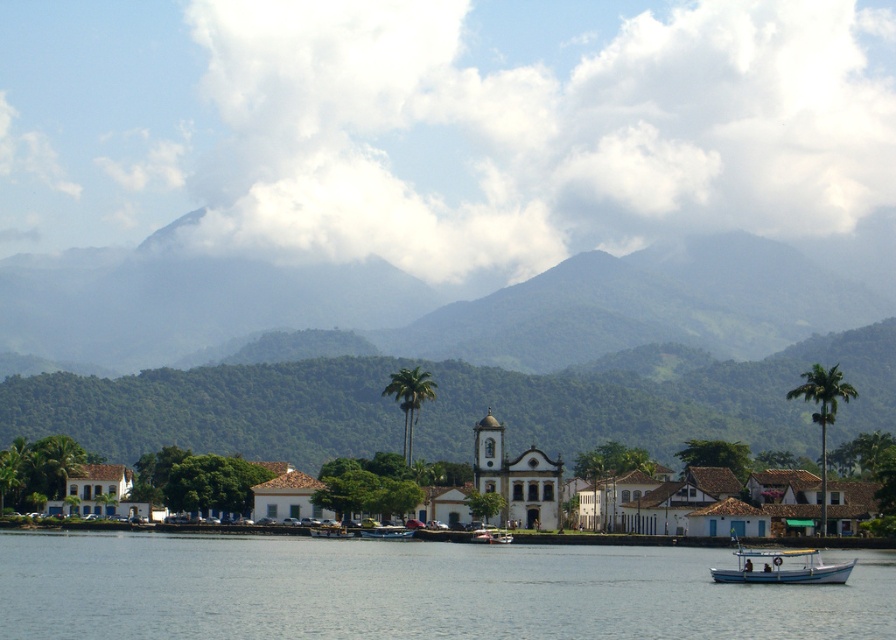
Question: Which object is the closest to the green leafy palm tree at upper right?

Choices:
 (A) metallic blue boat at center
 (B) white matte boat at lower right

Answer: (B)

Question: Which point is closer to the camera taking this photo?

Choices:
 (A) (403, 454)
 (B) (49, 449)
 (C) (790, 564)

Answer: (C)

Question: Is white matte boat at lower right above green leafy palm tree at upper right?

Choices:
 (A) no
 (B) yes

Answer: (B)

Question: Which point is farther from the camera taking this photo?

Choices:
 (A) (650, 308)
 (B) (202, 625)

Answer: (A)

Question: Does clear water at lower center have a larger size compared to green leafy palm tree at upper right?

Choices:
 (A) yes
 (B) no

Answer: (B)

Question: Can you confirm if green leafy mountain at center is thinner than clear water at lower center?

Choices:
 (A) yes
 (B) no

Answer: (B)